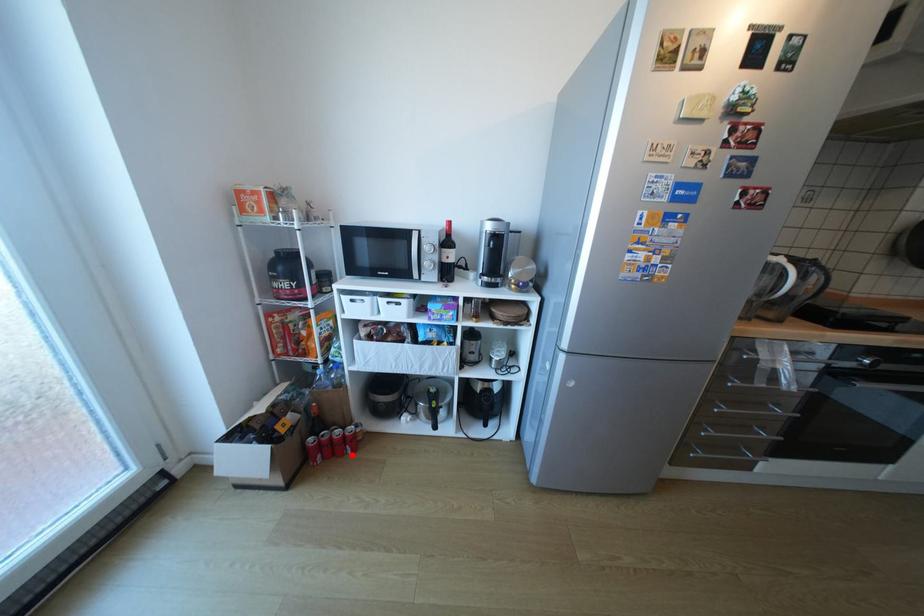
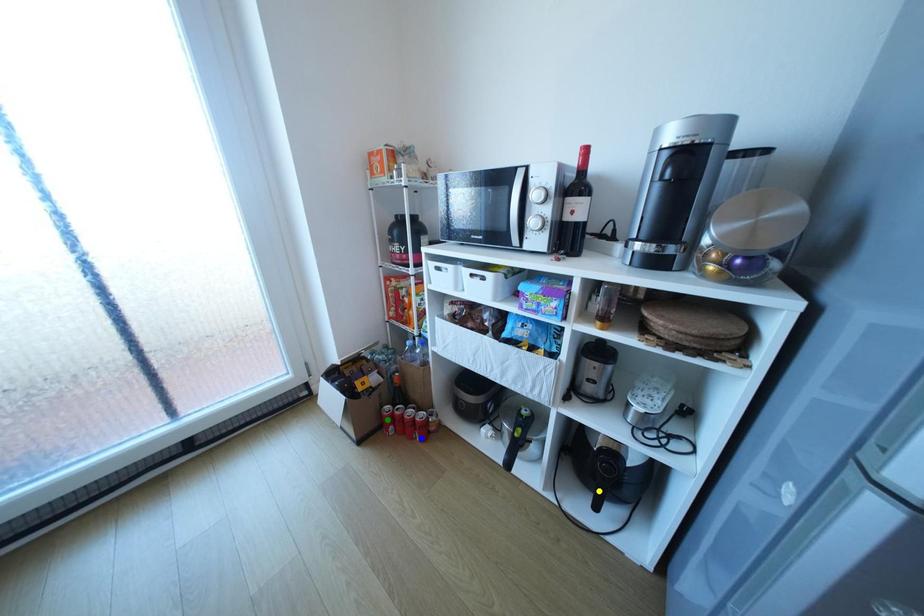
Question: I am providing you with two images of the same scene from different viewpoints. A red point is marked on the first image. You are given multiple points on the second image. In image 2, which mark is for the same physical point as the one in image 1?

Choices:
 (A) blue point
 (B) yellow point
 (C) green point

Answer: (A)